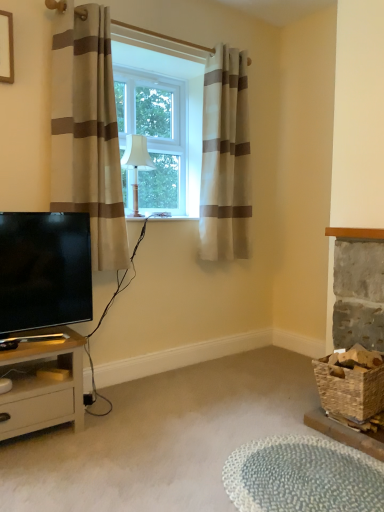
The width and height of the screenshot is (384, 512). I want to click on vacant area that lies between light beige wood nightstand at lower left and rustic woven basket at lower right, so click(190, 428).